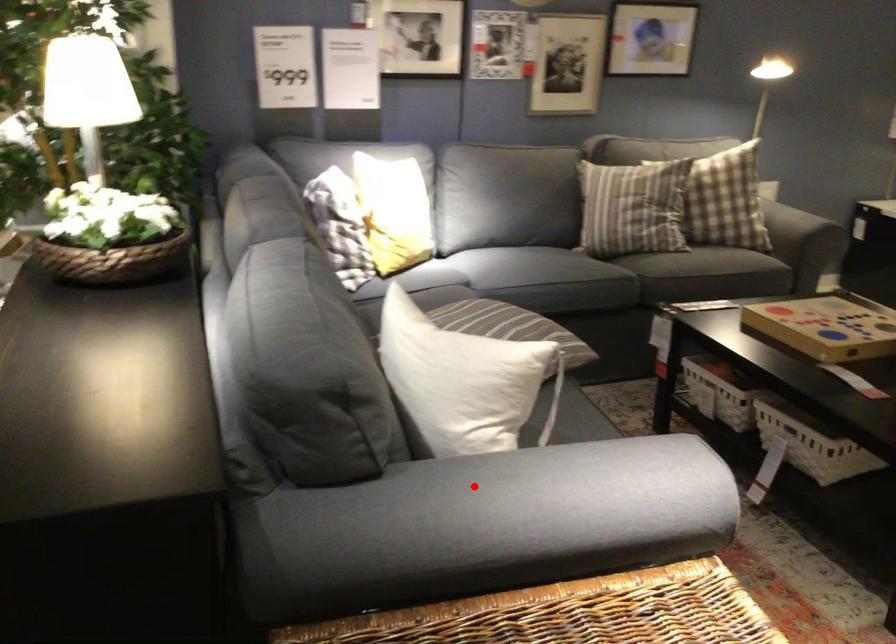
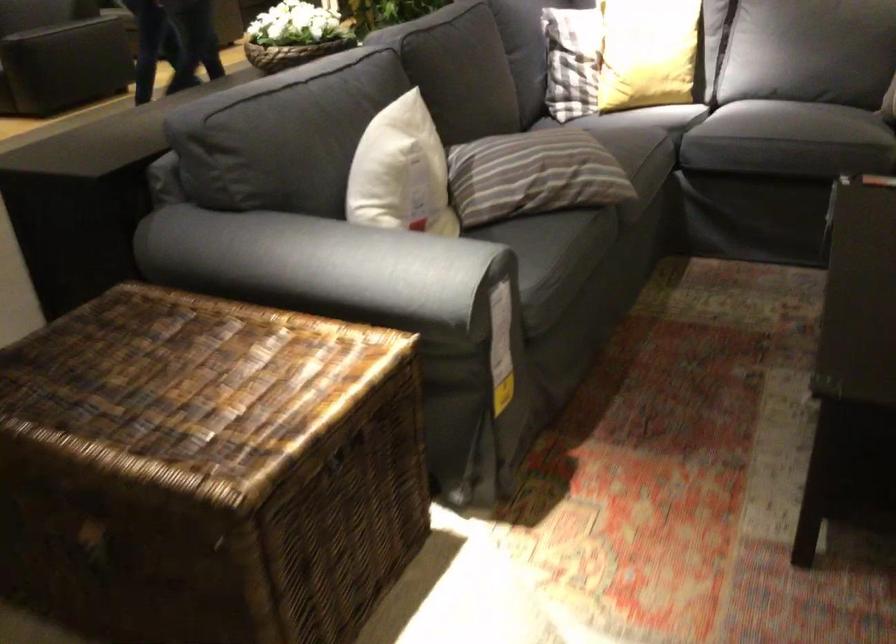
Question: I am providing you with two images of the same scene from different viewpoints. In image1, a red point is highlighted. Considering the same 3D point in image2, which of the following is correct?

Choices:
 (A) It is closer
 (B) It is farther

Answer: (B)